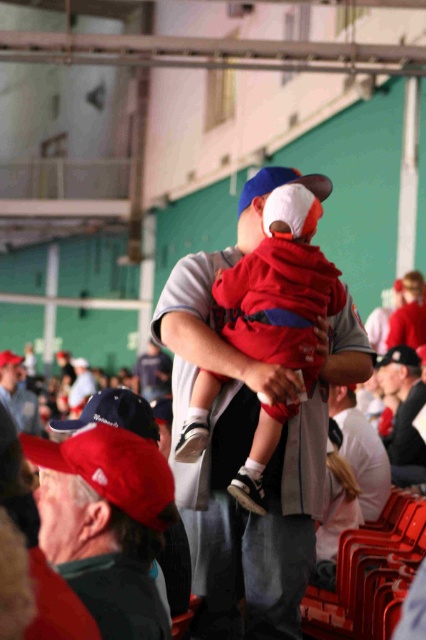
You are a photographer positioned at the center of the stadium. You want to take a photo that includes both the point at position [118,611] and the point at position [408,369]. Which point should you focus on first to ensure both are in the frame?

You should focus on point [118,611] first because it is closer to the viewer, ensuring that both points are within the frame.